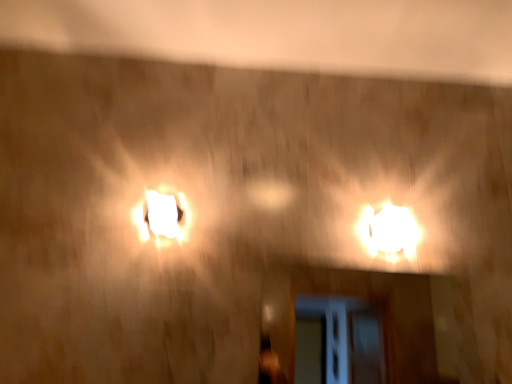
Question: Can you confirm if bright white plastic lamp at right, the 2th lamp positioned from the left, is shorter than white glossy lampshade at center, the 2th lamp positioned from the right?

Choices:
 (A) no
 (B) yes

Answer: (A)

Question: Can you confirm if bright white plastic lamp at right, which ranks as the 1th lamp in right-to-left order, is smaller than white glossy lampshade at center, the 2th lamp positioned from the right?

Choices:
 (A) yes
 (B) no

Answer: (B)

Question: From the image's perspective, is bright white plastic lamp at right, which ranks as the 1th lamp in right-to-left order, beneath white glossy lampshade at center, the 2th lamp positioned from the right?

Choices:
 (A) yes
 (B) no

Answer: (A)

Question: Is bright white plastic lamp at right, the 2th lamp positioned from the left, at the left side of white glossy lampshade at center, the 2th lamp positioned from the right?

Choices:
 (A) no
 (B) yes

Answer: (A)

Question: Is bright white plastic lamp at right, which ranks as the 1th lamp in right-to-left order, far away from white glossy lampshade at center, acting as the first lamp starting from the left?

Choices:
 (A) yes
 (B) no

Answer: (B)

Question: From a real-world perspective, is bright white plastic lamp at right, which ranks as the 1th lamp in right-to-left order, on top of white glossy lampshade at center, the 2th lamp positioned from the right?

Choices:
 (A) no
 (B) yes

Answer: (B)

Question: From the image's perspective, would you say white glossy lampshade at center, the 2th lamp positioned from the right, is shown under bright white plastic lamp at right, which ranks as the 1th lamp in right-to-left order?

Choices:
 (A) no
 (B) yes

Answer: (A)

Question: Is white glossy lampshade at center, acting as the first lamp starting from the left, turned away from bright white plastic lamp at right, the 2th lamp positioned from the left?

Choices:
 (A) no
 (B) yes

Answer: (A)

Question: Is the depth of white glossy lampshade at center, the 2th lamp positioned from the right, greater than that of bright white plastic lamp at right, which ranks as the 1th lamp in right-to-left order?

Choices:
 (A) yes
 (B) no

Answer: (B)

Question: Is white glossy lampshade at center, the 2th lamp positioned from the right, in contact with bright white plastic lamp at right, the 2th lamp positioned from the left?

Choices:
 (A) yes
 (B) no

Answer: (B)

Question: Does white glossy lampshade at center, acting as the first lamp starting from the left, appear on the left side of bright white plastic lamp at right, which ranks as the 1th lamp in right-to-left order?

Choices:
 (A) no
 (B) yes

Answer: (B)

Question: Does white glossy lampshade at center, the 2th lamp positioned from the right, have a lesser width compared to bright white plastic lamp at right, which ranks as the 1th lamp in right-to-left order?

Choices:
 (A) no
 (B) yes

Answer: (B)

Question: In terms of size, does white glossy lampshade at center, the 2th lamp positioned from the right, appear bigger or smaller than bright white plastic lamp at right, the 2th lamp positioned from the left?

Choices:
 (A) small
 (B) big

Answer: (A)